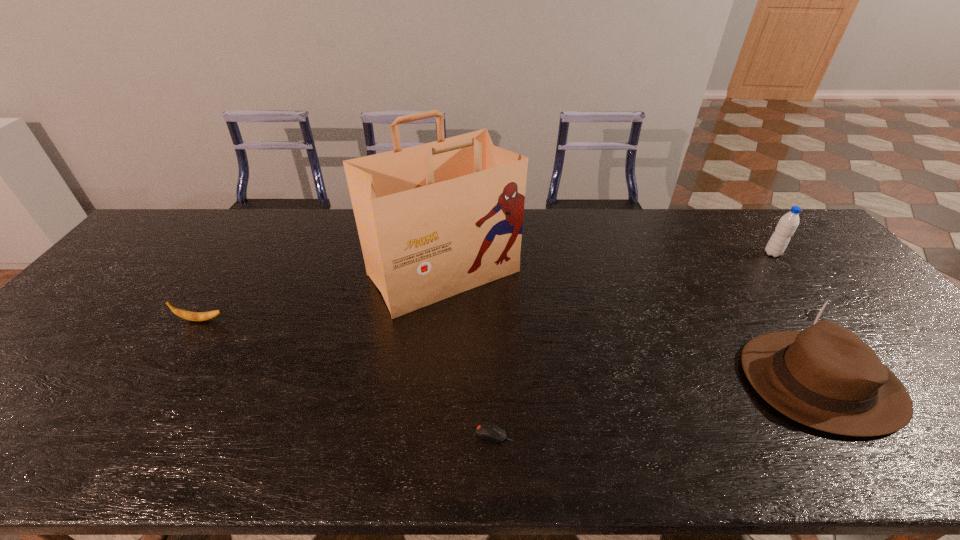
Locate an element on the screen. Image resolution: width=960 pixels, height=540 pixels. grocery bag is located at coordinates (434, 220).

This screenshot has width=960, height=540. In order to click on water bottle in this screenshot , I will do `click(788, 223)`.

The image size is (960, 540). I want to click on fedora, so click(x=825, y=377).

Locate an element on the screen. The image size is (960, 540). the fourth tallest object is located at coordinates (188, 315).

I want to click on the leftmost object, so click(188, 315).

Identify the location of the shortest object. (486, 430).

What are the coordinates of `vacant space located on the side of the tallest object with the superhero design` in the screenshot? It's located at (438, 342).

Locate an element on the screen. This screenshot has width=960, height=540. free spot located on the right of the water bottle is located at coordinates (815, 253).

Where is `free space located on the feather side of the fedora`? The height and width of the screenshot is (540, 960). free space located on the feather side of the fedora is located at coordinates (673, 381).

Find the location of a particular element. free space located 0.300m on the feather side of the fedora is located at coordinates (617, 381).